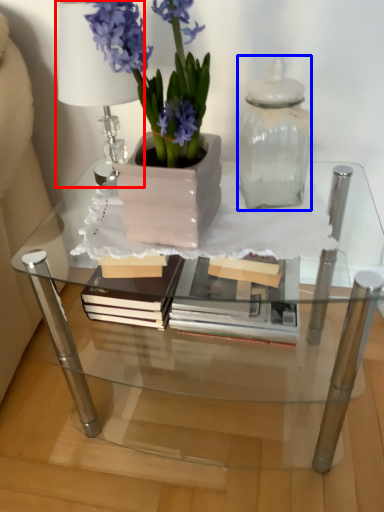
Question: Among these objects, which one is farthest to the camera, table lamp (highlighted by a red box) or glass vase (highlighted by a blue box)?

Choices:
 (A) table lamp
 (B) glass vase

Answer: (A)